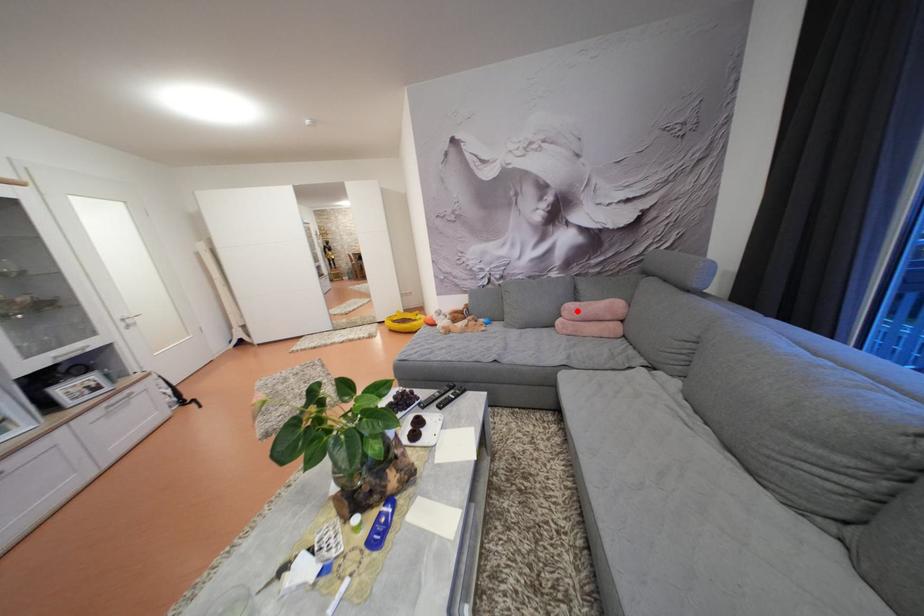
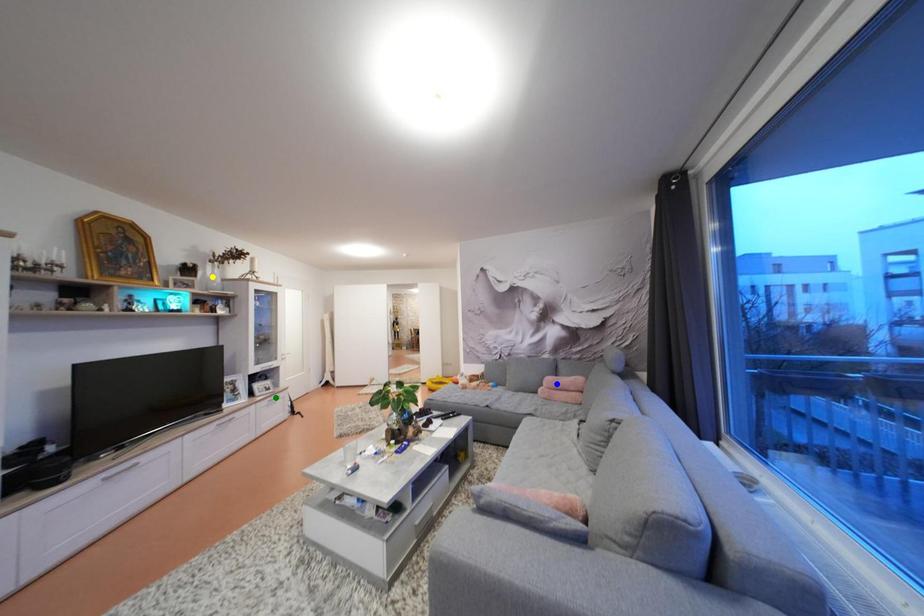
Question: I am providing you with two images of the same scene from different viewpoints. A red point is marked on the first image. You are given multiple points on the second image. Which point in image 2 represents the same 3d spot as the red point in image 1?

Choices:
 (A) yellow point
 (B) blue point
 (C) green point

Answer: (B)